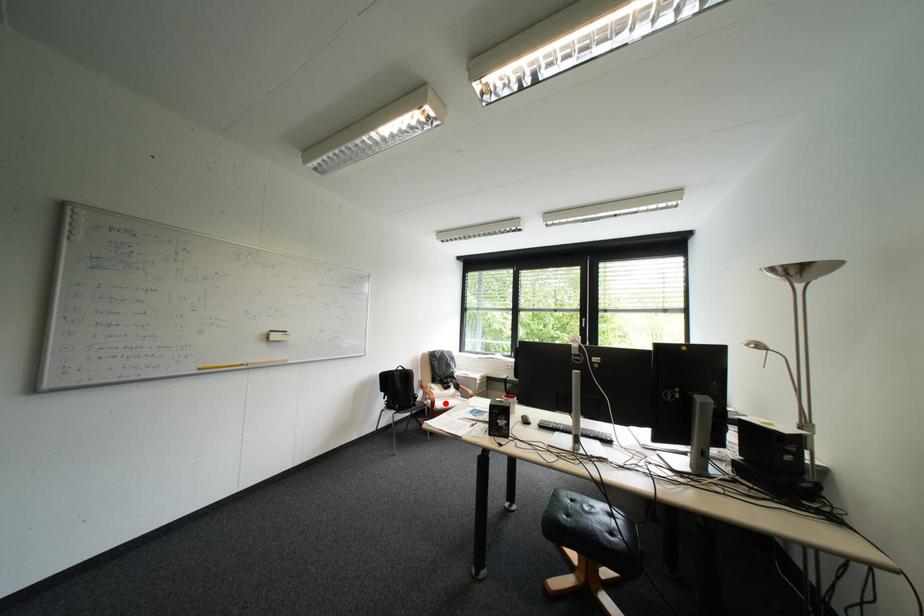
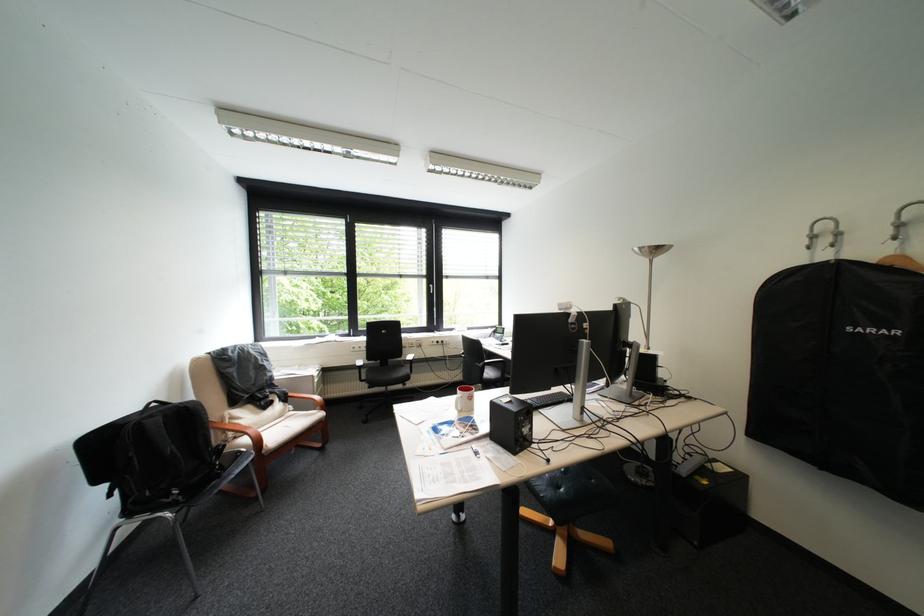
Question: A red point is marked in image1. In image2, is the corresponding 3D point closer to the camera or farther? Reply with the corresponding letter.

Choices:
 (A) The corresponding 3D point is closer.
 (B) The corresponding 3D point is farther.

Answer: (A)